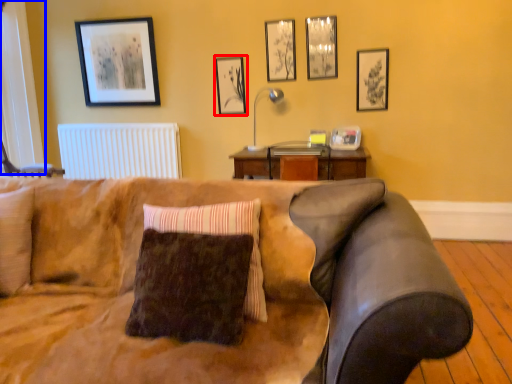
Question: Among these objects, which one is farthest to the camera, picture frame (highlighted by a red box) or window (highlighted by a blue box)?

Choices:
 (A) picture frame
 (B) window

Answer: (A)